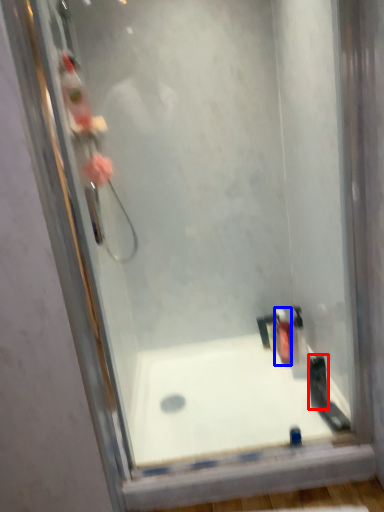
Question: Which of the following is the farthest to the observer, toiletry (highlighted by a red box) or toiletry (highlighted by a blue box)?

Choices:
 (A) toiletry
 (B) toiletry

Answer: (B)